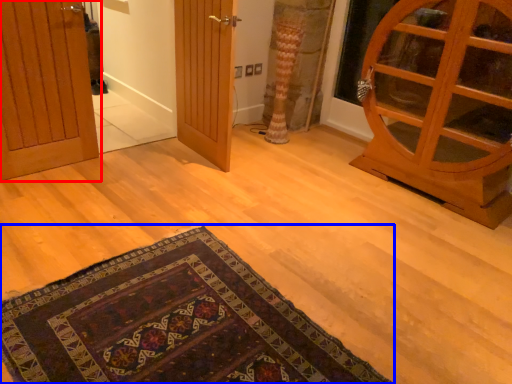
Question: Which point is further to the camera, door (highlighted by a red box) or mat (highlighted by a blue box)?

Choices:
 (A) door
 (B) mat

Answer: (A)